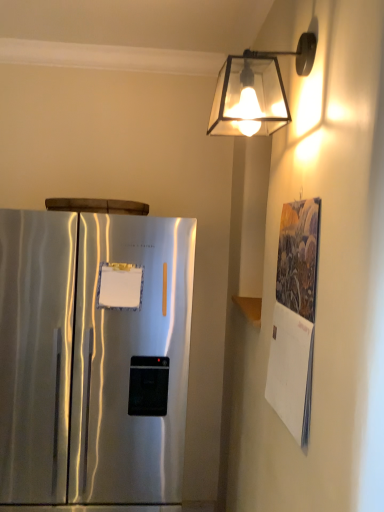
Question: From the image's perspective, is translucent glass lampshade at upper right located above satin silver refrigerator at left?

Choices:
 (A) no
 (B) yes

Answer: (B)

Question: Considering the relative sizes of translucent glass lampshade at upper right and satin silver refrigerator at left in the image provided, is translucent glass lampshade at upper right smaller than satin silver refrigerator at left?

Choices:
 (A) no
 (B) yes

Answer: (B)

Question: Is translucent glass lampshade at upper right far from satin silver refrigerator at left?

Choices:
 (A) no
 (B) yes

Answer: (A)

Question: Does translucent glass lampshade at upper right lie in front of satin silver refrigerator at left?

Choices:
 (A) no
 (B) yes

Answer: (B)

Question: Is translucent glass lampshade at upper right thinner than satin silver refrigerator at left?

Choices:
 (A) yes
 (B) no

Answer: (A)

Question: Considering the positions of point (114, 231) and point (306, 352), is point (114, 231) closer or farther from the camera than point (306, 352)?

Choices:
 (A) closer
 (B) farther

Answer: (B)

Question: Is satin silver refrigerator at left inside the boundaries of textured paper calendar at right, or outside?

Choices:
 (A) inside
 (B) outside

Answer: (B)

Question: Is satin silver refrigerator at left to the left or to the right of textured paper calendar at right in the image?

Choices:
 (A) right
 (B) left

Answer: (B)

Question: From the image's perspective, is satin silver refrigerator at left above or below textured paper calendar at right?

Choices:
 (A) below
 (B) above

Answer: (A)

Question: Considering their positions, is translucent glass lampshade at upper right located in front of or behind satin silver refrigerator at left?

Choices:
 (A) behind
 (B) front

Answer: (B)

Question: Is point (231, 81) closer or farther from the camera than point (69, 265)?

Choices:
 (A) farther
 (B) closer

Answer: (B)

Question: Would you say translucent glass lampshade at upper right is to the left or to the right of satin silver refrigerator at left in the picture?

Choices:
 (A) right
 (B) left

Answer: (A)

Question: From a real-world perspective, is translucent glass lampshade at upper right positioned above or below satin silver refrigerator at left?

Choices:
 (A) below
 (B) above

Answer: (B)

Question: From the image's perspective, relative to satin silver refrigerator at left, is textured paper calendar at right above or below?

Choices:
 (A) above
 (B) below

Answer: (A)

Question: Relative to satin silver refrigerator at left, is textured paper calendar at right in front or behind?

Choices:
 (A) front
 (B) behind

Answer: (A)